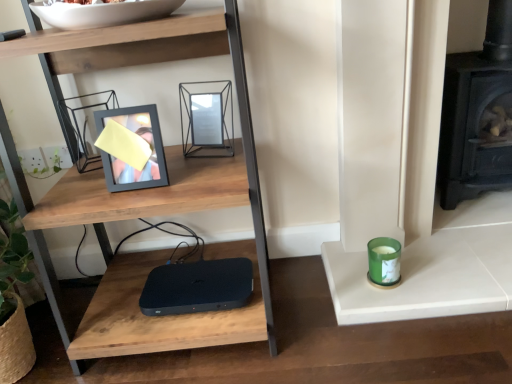
Find the location of a particular element. vacant space situated on the left part of green glass candle at right is located at coordinates (318, 305).